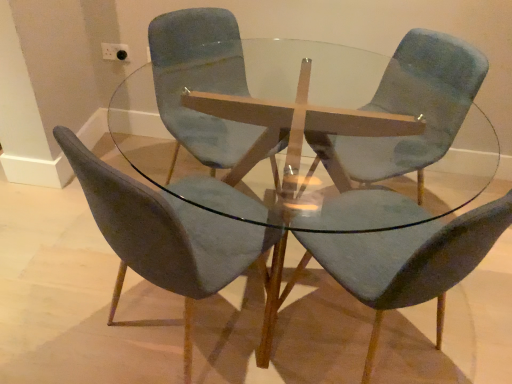
Question: Does velvet blue chair at center, which appears as the 3th chair when viewed from the right, appear on the left side of transparent glass table at center?

Choices:
 (A) yes
 (B) no

Answer: (A)

Question: Is velvet blue chair at center, which appears as the 3th chair when viewed from the right, turned away from transparent glass table at center?

Choices:
 (A) no
 (B) yes

Answer: (B)

Question: Is velvet blue chair at center, which appears as the 3th chair when viewed from the right, in contact with transparent glass table at center?

Choices:
 (A) yes
 (B) no

Answer: (B)

Question: Is velvet blue chair at center, placed as the 2th chair when sorted from left to right, positioned before transparent glass table at center?

Choices:
 (A) yes
 (B) no

Answer: (B)

Question: Considering the relative sizes of velvet blue chair at center, which appears as the 3th chair when viewed from the right, and transparent glass table at center in the image provided, is velvet blue chair at center, which appears as the 3th chair when viewed from the right, thinner than transparent glass table at center?

Choices:
 (A) no
 (B) yes

Answer: (B)

Question: Can you confirm if velvet blue chair at center, placed as the 2th chair when sorted from left to right, is positioned to the right of transparent glass table at center?

Choices:
 (A) no
 (B) yes

Answer: (A)

Question: Can you confirm if velvet blue chair at center, which appears as the 3th chair when viewed from the right, is wider than velvet blue chair at center, the first chair positioned from the left?

Choices:
 (A) no
 (B) yes

Answer: (A)

Question: Is velvet blue chair at center, placed as the 2th chair when sorted from left to right, with velvet blue chair at center, which is counted as the 4th chair, starting from the right?

Choices:
 (A) no
 (B) yes

Answer: (A)

Question: Could velvet blue chair at center, which is counted as the 4th chair, starting from the right, be considered to be inside velvet blue chair at center, placed as the 2th chair when sorted from left to right?

Choices:
 (A) no
 (B) yes

Answer: (A)

Question: Can you confirm if velvet blue chair at center, placed as the 2th chair when sorted from left to right, is positioned to the right of velvet blue chair at center, the first chair positioned from the left?

Choices:
 (A) no
 (B) yes

Answer: (B)

Question: Is velvet blue chair at center, which appears as the 3th chair when viewed from the right, smaller than velvet blue chair at center, the first chair positioned from the left?

Choices:
 (A) no
 (B) yes

Answer: (B)

Question: From a real-world perspective, is velvet blue chair at center, which appears as the 3th chair when viewed from the right, on velvet blue chair at center, which is counted as the 4th chair, starting from the right?

Choices:
 (A) yes
 (B) no

Answer: (A)

Question: Is velvet blue chair at center, the first chair positioned from the left, at the right side of velvet blue chair at center, which appears as the 3th chair when viewed from the right?

Choices:
 (A) yes
 (B) no

Answer: (B)